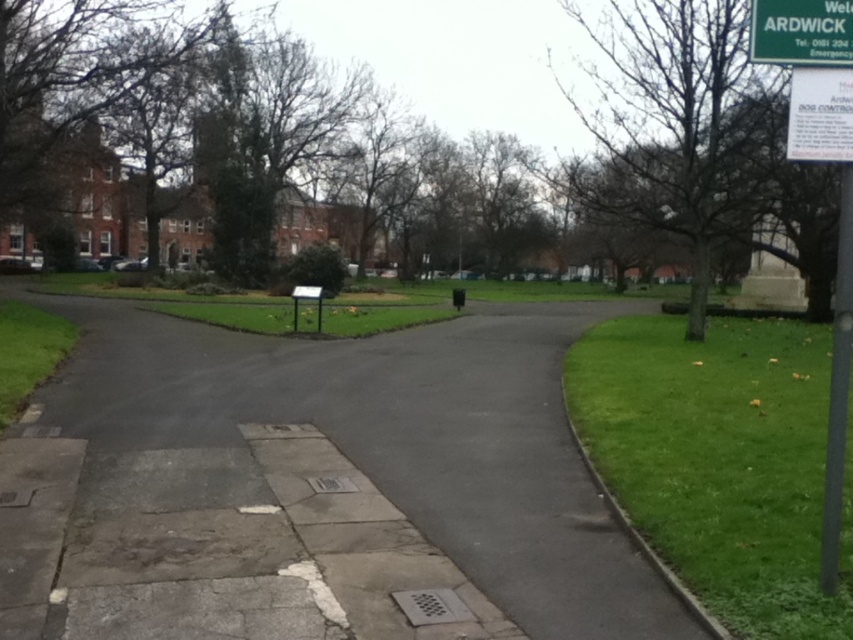
Question: Can you confirm if green grass at lower right is positioned below green plastic sign at upper right?

Choices:
 (A) yes
 (B) no

Answer: (A)

Question: Among these objects, which one is nearest to the camera?

Choices:
 (A) black metal pole at right
 (B) gray concrete pavement at center

Answer: (A)

Question: Does gray concrete pavement at center have a larger size compared to green grass at lower right?

Choices:
 (A) yes
 (B) no

Answer: (A)

Question: Which of the following is the farthest from the observer?

Choices:
 (A) (28, 323)
 (B) (138, 358)

Answer: (A)

Question: Observing the image, what is the correct spatial positioning of green plastic sign at upper right in reference to white paper sign at upper right?

Choices:
 (A) right
 (B) left

Answer: (B)

Question: Which point appears closest to the camera in this image?

Choices:
 (A) (714, 332)
 (B) (36, 320)
 (C) (792, 42)
 (D) (828, 570)

Answer: (C)